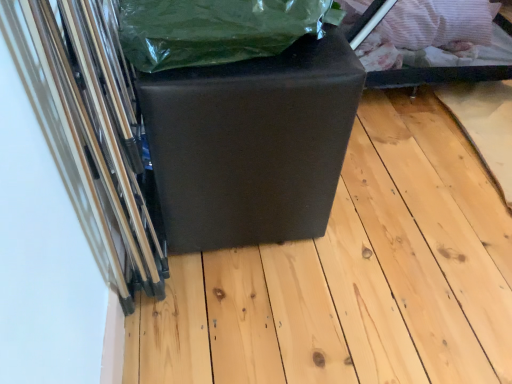
Question: Is point (185, 339) closer or farther from the camera than point (185, 81)?

Choices:
 (A) farther
 (B) closer

Answer: (A)

Question: From a real-world perspective, is matte black cube at center above or below matte black cube at center?

Choices:
 (A) above
 (B) below

Answer: (B)

Question: Estimate the real-world distances between objects in this image. Which object is closer to the matte black cube at center?

Choices:
 (A) green plastic bag at upper center
 (B) matte black cube at center

Answer: (A)

Question: Which of these objects is positioned closest to the matte black cube at center?

Choices:
 (A) green plastic bag at upper center
 (B) matte black cube at center

Answer: (B)